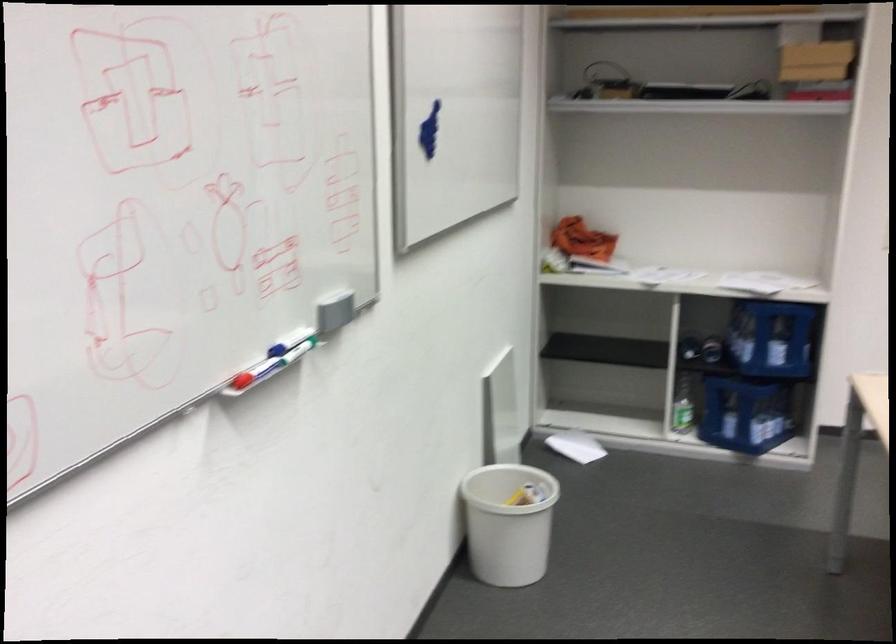
This screenshot has height=644, width=896. Identify the location of green glass bottle. (682, 406).